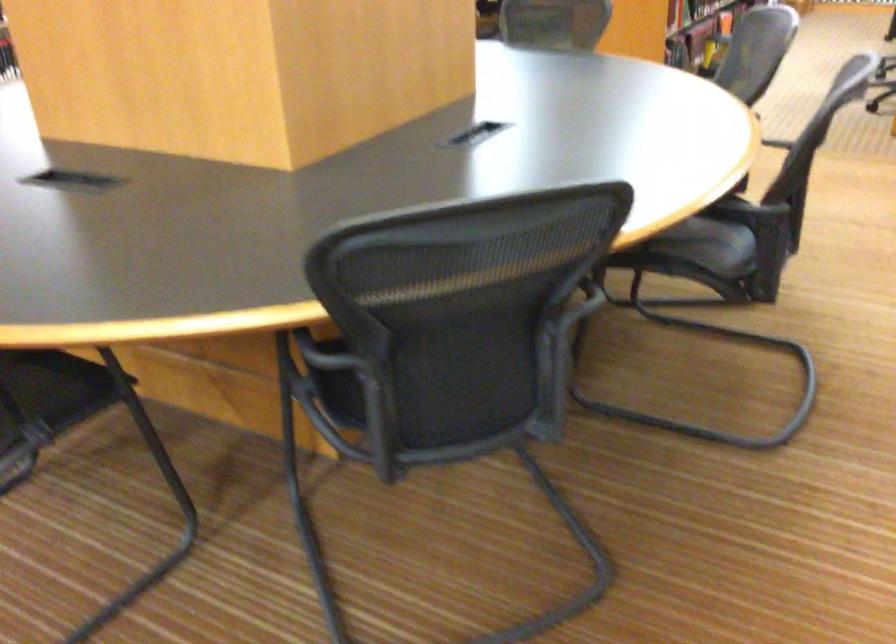
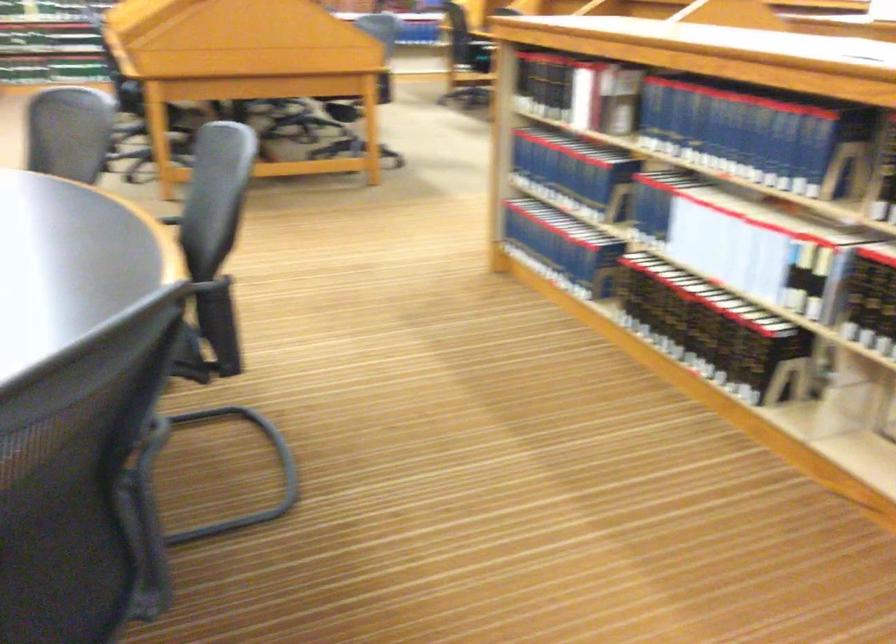
Question: The images are taken continuously from a first-person perspective. In which direction is your viewpoint rotating?

Choices:
 (A) Left
 (B) Right
 (C) Up
 (D) Down

Answer: (B)